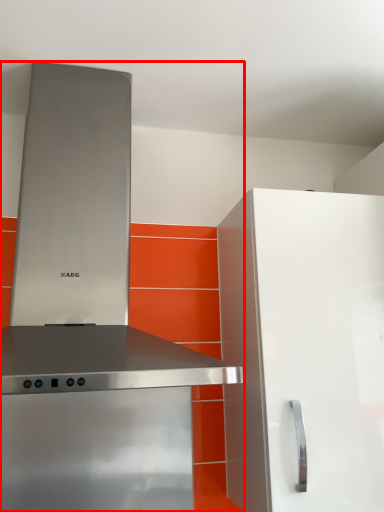
Question: In this image, where is home appliance (annotated by the red box) located relative to cabinetry?

Choices:
 (A) left
 (B) right

Answer: (A)